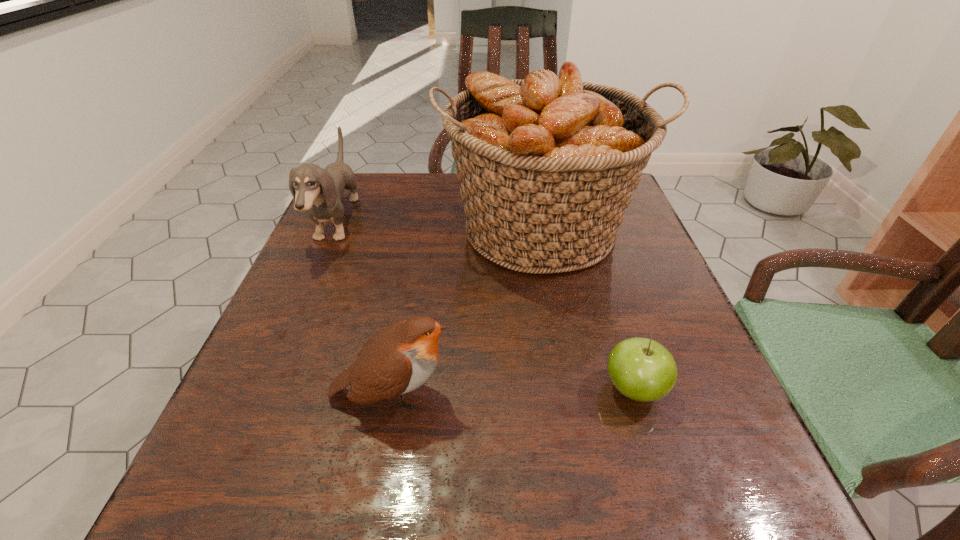
Find the location of a particular element. This screenshot has width=960, height=540. the tallest object is located at coordinates [547, 165].

Locate an element on the screen. The image size is (960, 540). the leftmost object is located at coordinates (319, 191).

This screenshot has width=960, height=540. Find the location of `bird`. bird is located at coordinates (399, 358).

Find the location of `the shortest object`. the shortest object is located at coordinates (643, 370).

Find the location of `free spot located 0.110m on the front of the tallest object`. free spot located 0.110m on the front of the tallest object is located at coordinates (560, 332).

At what (x,y) coordinates should I click in order to perform the action: click on free space located at the face of the puppy. Please return your answer as a coordinate pair (x, y). Looking at the image, I should click on (460, 222).

Locate an element on the screen. This screenshot has width=960, height=540. vacant area situated 0.050m at the face of the third tallest object is located at coordinates (487, 394).

You are a GUI agent. You are given a task and a screenshot of the screen. Output one action in this format:
    pyautogui.click(x=<x>, y=<y>)
    Task: Click on the free space located on the left of the shortest object
    
    Given the screenshot: What is the action you would take?
    pyautogui.click(x=413, y=389)

Identify the location of basket located in the far edge section of the desktop. The height and width of the screenshot is (540, 960). (547, 165).

At what (x,y) coordinates should I click in order to perform the action: click on puppy positioned at the far edge. Please return your answer as a coordinate pair (x, y). Looking at the image, I should click on (319, 191).